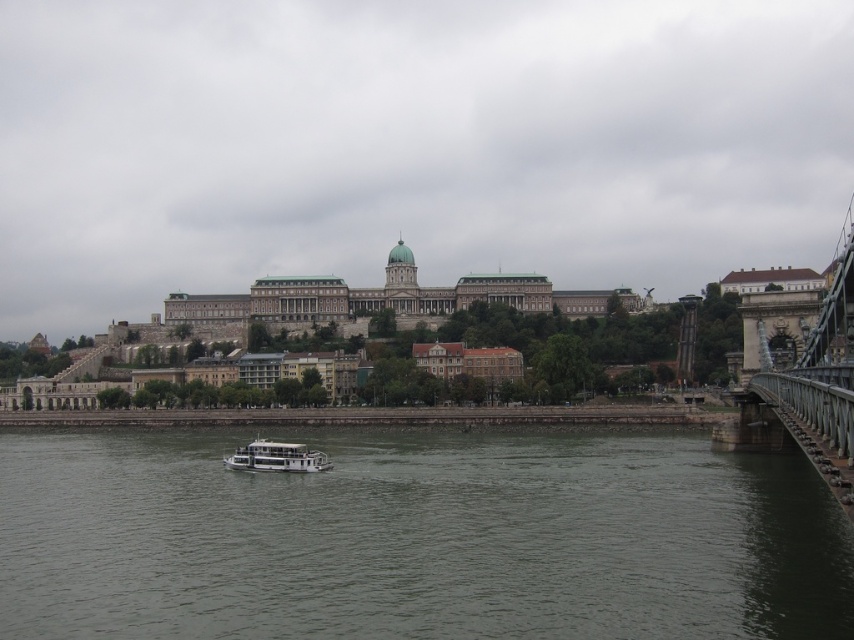
Which is above, metallic chain-link bridge at right or white matte boat at center?

Positioned higher is metallic chain-link bridge at right.

Is metallic chain-link bridge at right further to camera compared to white matte boat at center?

No.

Is point (759, 342) closer to camera compared to point (244, 460)?

No, it is behind (244, 460).

Find the location of a particular element. The image size is (854, 640). metallic chain-link bridge at right is located at coordinates (819, 380).

Is gray water at center positioned in front of white matte boat at center?

Yes, gray water at center is closer to the viewer.

Can you confirm if gray water at center is shorter than white matte boat at center?

Incorrect, gray water at center's height does not fall short of white matte boat at center's.

Where is `gray water at center`? gray water at center is located at coordinates (417, 538).

Where is `gray water at center`? The image size is (854, 640). gray water at center is located at coordinates (417, 538).

Can you confirm if gray water at center is thinner than metallic chain-link bridge at right?

No.

Measure the distance from gray water at center to metallic chain-link bridge at right.

gray water at center and metallic chain-link bridge at right are 126.30 feet apart.

What do you see at coordinates (417, 538) in the screenshot?
I see `gray water at center` at bounding box center [417, 538].

Locate an element on the screen. gray water at center is located at coordinates (417, 538).